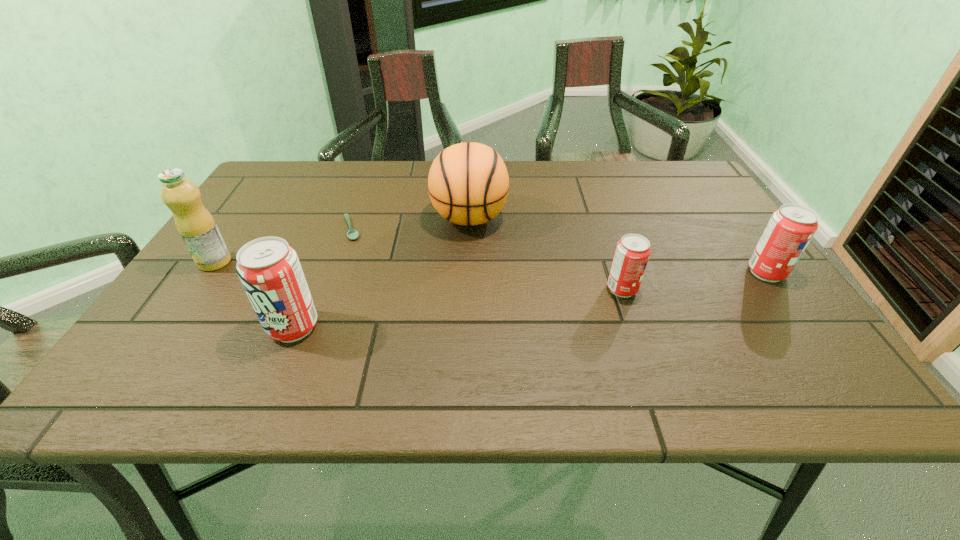
Locate an element on the screen. The width and height of the screenshot is (960, 540). free space that satisfies the following two spatial constraints: 1. on the front side of the rightmost object; 2. on the left side of the fourth object from left to right is located at coordinates (468, 273).